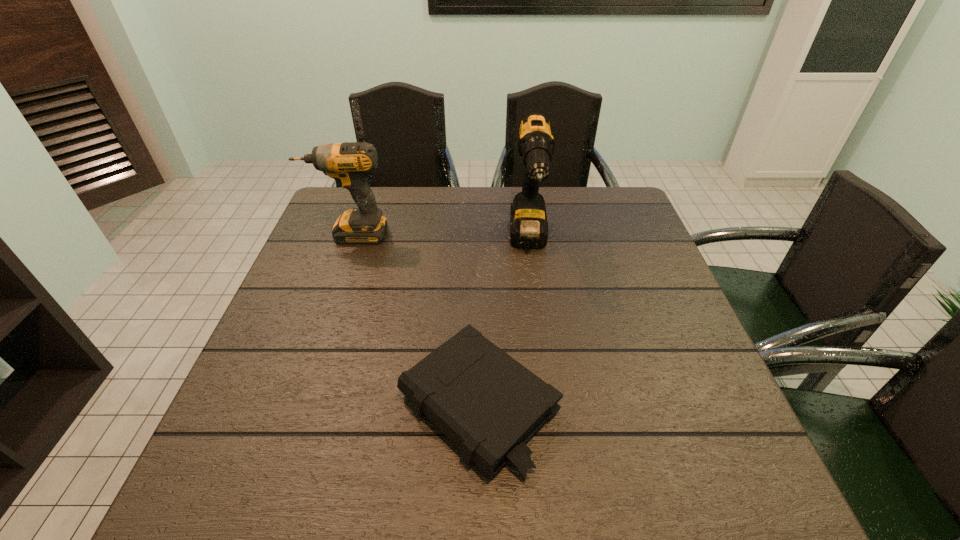
I want to click on blank area in the image that satisfies the following two spatial constraints: 1. with the drill bit of the left drill facing forward; 2. on the back side of the shortest object, so click(x=288, y=404).